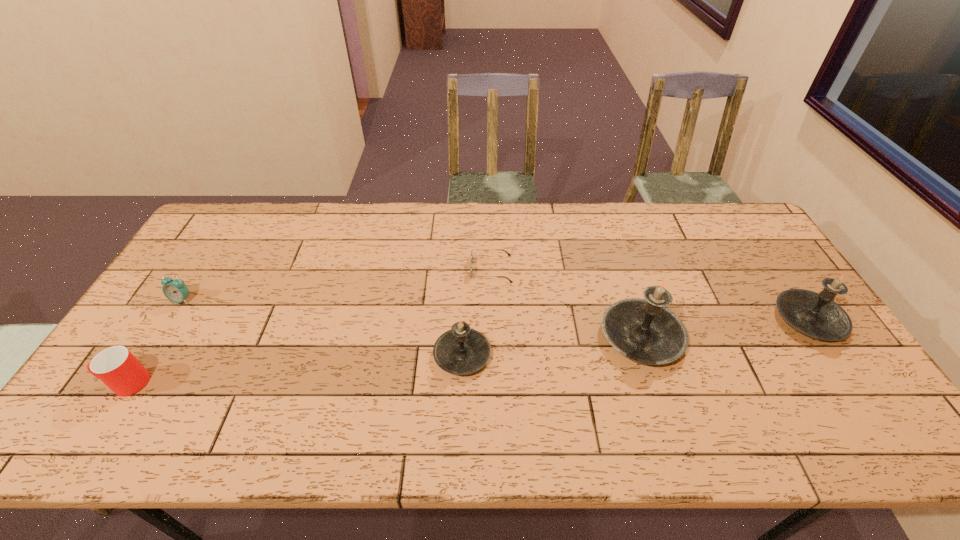
Find the location of a particular element. This screenshot has width=960, height=540. cup that is at the left edge is located at coordinates (116, 367).

Image resolution: width=960 pixels, height=540 pixels. I want to click on object positioned at the right edge, so click(x=815, y=314).

I want to click on object positioned at the near left corner, so click(116, 367).

The height and width of the screenshot is (540, 960). What are the coordinates of `vacant area at the far edge` in the screenshot? It's located at (566, 202).

In the image, there is a desktop. Where is `vacant region at the near edge`? vacant region at the near edge is located at coordinates point(201,405).

In the image, there is a desktop. Where is `vacant area at the left edge`? vacant area at the left edge is located at coordinates (197, 254).

Find the location of a particular element. free point at the right edge is located at coordinates (835, 353).

You are a GUI agent. You are given a task and a screenshot of the screen. Output one action in this format:
    pyautogui.click(x=<x>, y=<y>)
    Task: Click on the vacant space at the far left corner
    The width and height of the screenshot is (960, 540).
    Given the screenshot: What is the action you would take?
    pyautogui.click(x=223, y=235)

Where is `free space at the far right corner of the desktop`? The image size is (960, 540). free space at the far right corner of the desktop is located at coordinates (728, 239).

You are a GUI agent. You are given a task and a screenshot of the screen. Output one action in this format:
    pyautogui.click(x=<x>, y=<y>)
    Task: Click on the blank area at the near right corner
    
    Given the screenshot: What is the action you would take?
    coord(817,408)